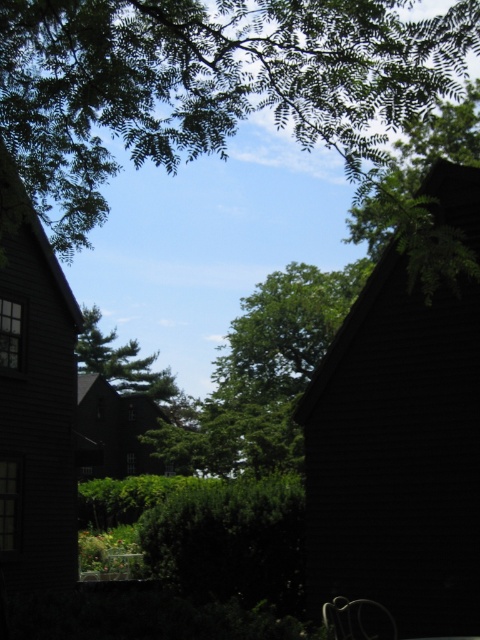
Question: Considering the relative positions of green leafy tree at upper center and metallic silver chair at lower right in the image provided, where is green leafy tree at upper center located with respect to metallic silver chair at lower right?

Choices:
 (A) below
 (B) above

Answer: (B)

Question: Which object appears closest to the camera in this image?

Choices:
 (A) metallic silver chair at lower right
 (B) green leafy tree at upper center

Answer: (B)

Question: Considering the real-world distances, which object is farthest from the green matte tree at center?

Choices:
 (A) metallic silver chair at lower right
 (B) green leafy tree at upper center

Answer: (A)

Question: Observing the image, what is the correct spatial positioning of green matte tree at center in reference to metallic silver chair at lower right?

Choices:
 (A) below
 (B) above

Answer: (B)

Question: Does green leafy tree at upper center have a lesser width compared to metallic silver chair at lower right?

Choices:
 (A) no
 (B) yes

Answer: (A)

Question: Based on their relative distances, which object is farther from the metallic silver chair at lower right?

Choices:
 (A) green matte tree at center
 (B) green leafy tree at upper center

Answer: (A)